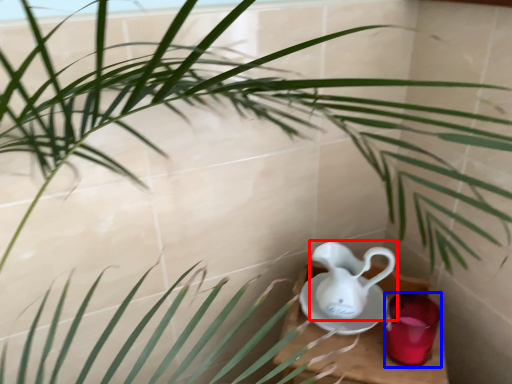
Question: Which object is further to the camera taking this photo, jug (highlighted by a red box) or tableware (highlighted by a blue box)?

Choices:
 (A) jug
 (B) tableware

Answer: (B)